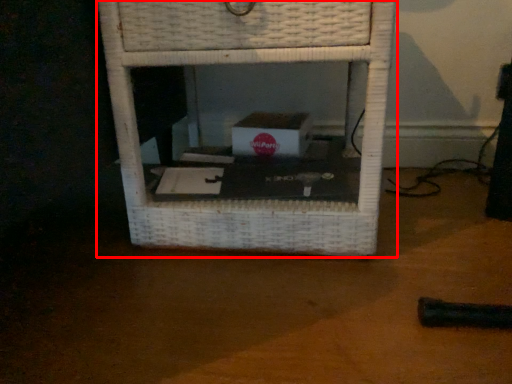
Question: From the image's perspective, what is the correct spatial relationship of furniture (annotated by the red box) in relation to table top?

Choices:
 (A) below
 (B) above

Answer: (B)